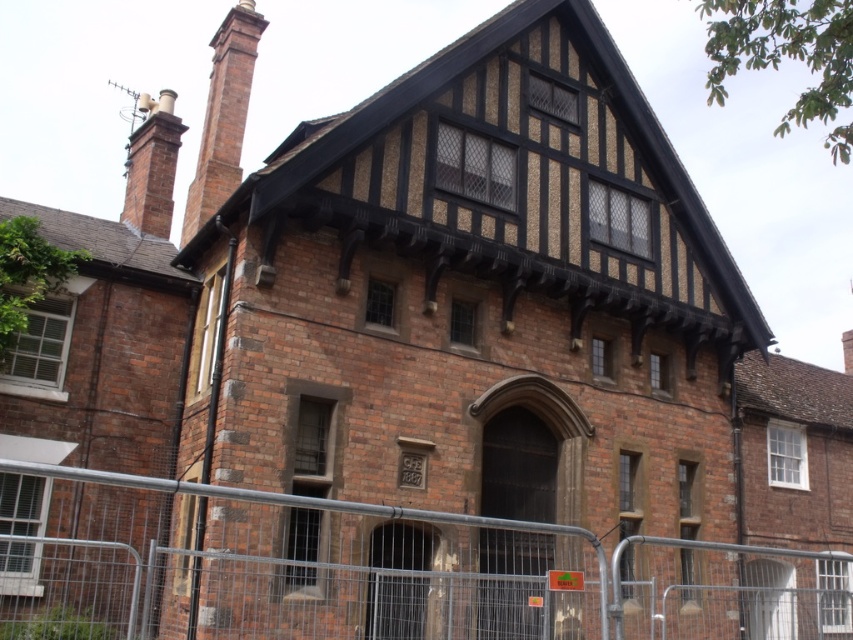
Can you confirm if red brick chimney at upper left is bigger than brick chimney at upper left?

Indeed, red brick chimney at upper left has a larger size compared to brick chimney at upper left.

Is point (204, 124) more distant than point (132, 132)?

No, (204, 124) is closer to viewer.

The width and height of the screenshot is (853, 640). In order to click on red brick chimney at upper left in this screenshot , I will do `click(223, 115)`.

In order to click on red brick chimney at upper left in this screenshot , I will do `click(223, 115)`.

Is metal fence at center further to the viewer compared to brick chimney at upper left?

No.

What do you see at coordinates (372, 572) in the screenshot? I see `metal fence at center` at bounding box center [372, 572].

In order to click on metal fence at center in this screenshot , I will do `click(372, 572)`.

Can you confirm if metal fence at center is bigger than red brick chimney at upper left?

Indeed, metal fence at center has a larger size compared to red brick chimney at upper left.

The image size is (853, 640). Identify the location of metal fence at center. pyautogui.click(x=372, y=572).